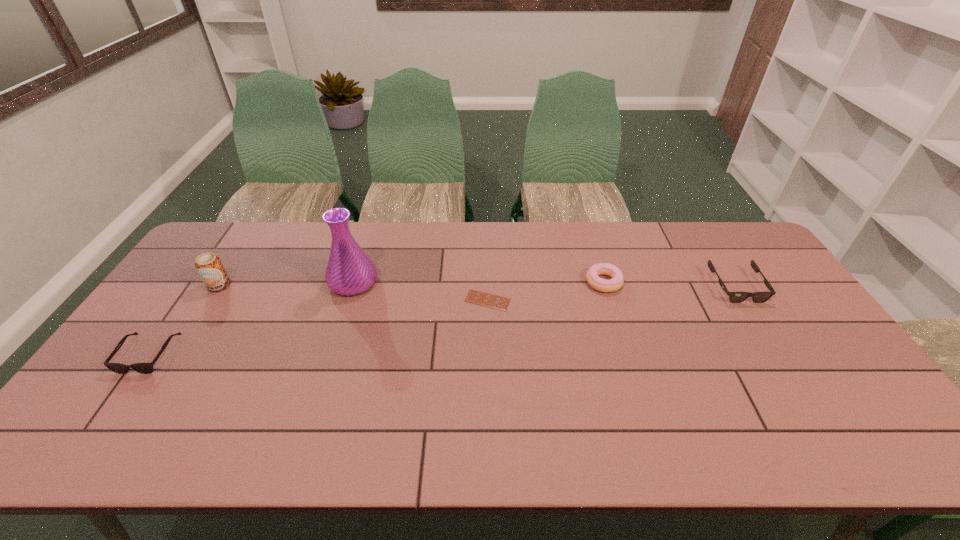
Identify the location of vacant space at the near edge of the desktop. The height and width of the screenshot is (540, 960). (484, 438).

Image resolution: width=960 pixels, height=540 pixels. I want to click on free location at the left edge of the desktop, so pos(189,282).

In the image, there is a desktop. Where is `vacant space at the right edge`? vacant space at the right edge is located at coordinates (840, 395).

The height and width of the screenshot is (540, 960). I want to click on vacant area that lies between the left sunglasses and the vase, so click(x=251, y=319).

Image resolution: width=960 pixels, height=540 pixels. What are the coordinates of `unoccupied area between the fifth shortest object and the left sunglasses` in the screenshot? It's located at (184, 320).

At what (x,y) coordinates should I click in order to perform the action: click on unoccupied area between the right sunglasses and the fifth shortest object. Please return your answer as a coordinate pair (x, y). The image size is (960, 540). Looking at the image, I should click on (478, 286).

Identify the location of free spot between the right sunglasses and the tallest object. pyautogui.click(x=544, y=285).

Where is `vacant space in between the fifth object from left to right and the chocolate bar`? The height and width of the screenshot is (540, 960). vacant space in between the fifth object from left to right and the chocolate bar is located at coordinates (545, 291).

Identify the location of free space between the vase and the nearer sunglasses. The width and height of the screenshot is (960, 540). (251, 319).

Locate an element on the screen. Image resolution: width=960 pixels, height=540 pixels. free space between the left sunglasses and the vase is located at coordinates (251, 319).